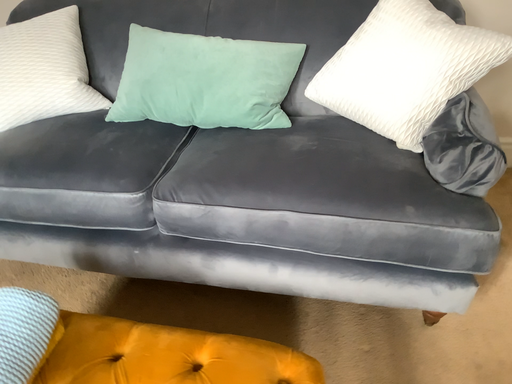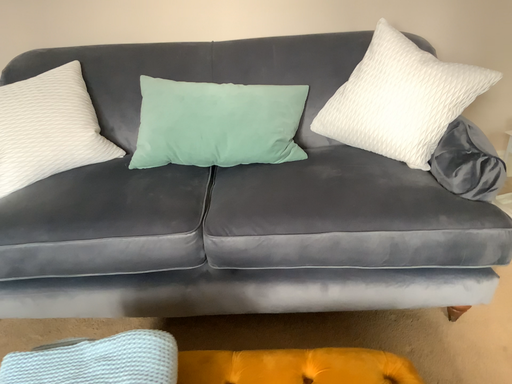
Question: How did the camera likely rotate when shooting the video?

Choices:
 (A) rotated left
 (B) rotated right

Answer: (B)